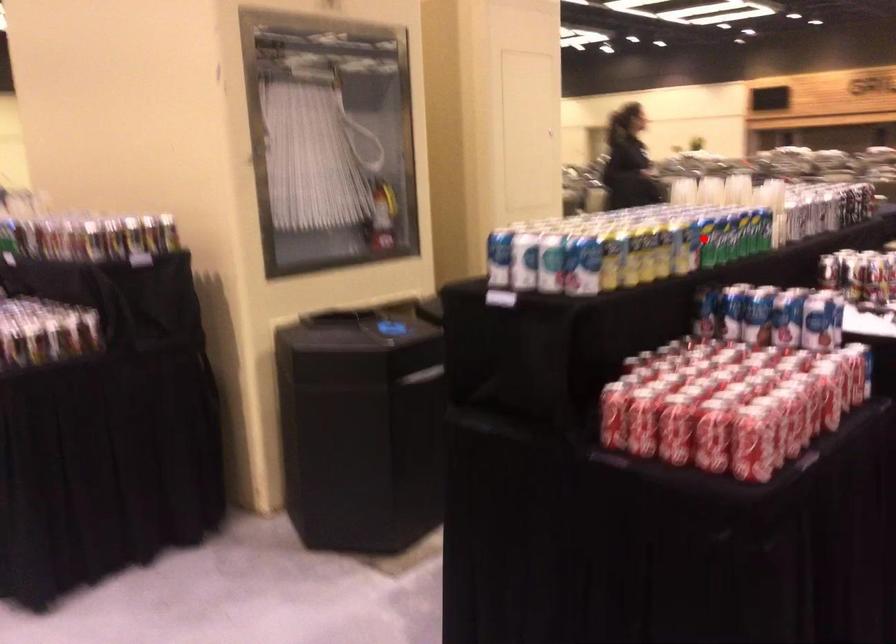
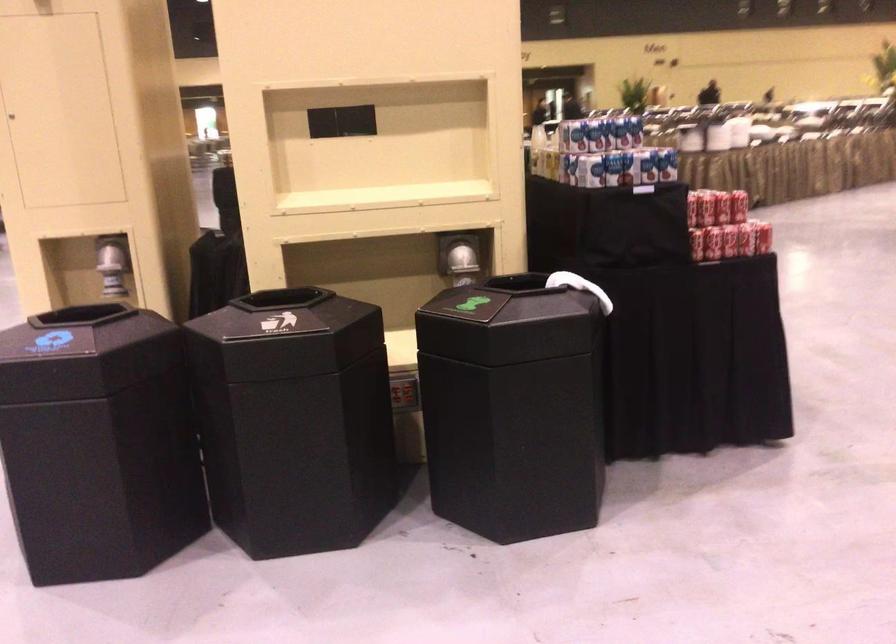
Question: I am providing you with two images of the same scene from different viewpoints. A red point is marked on the first image. Is the red point's position out of view in image 2?

Choices:
 (A) Yes
 (B) No

Answer: (A)